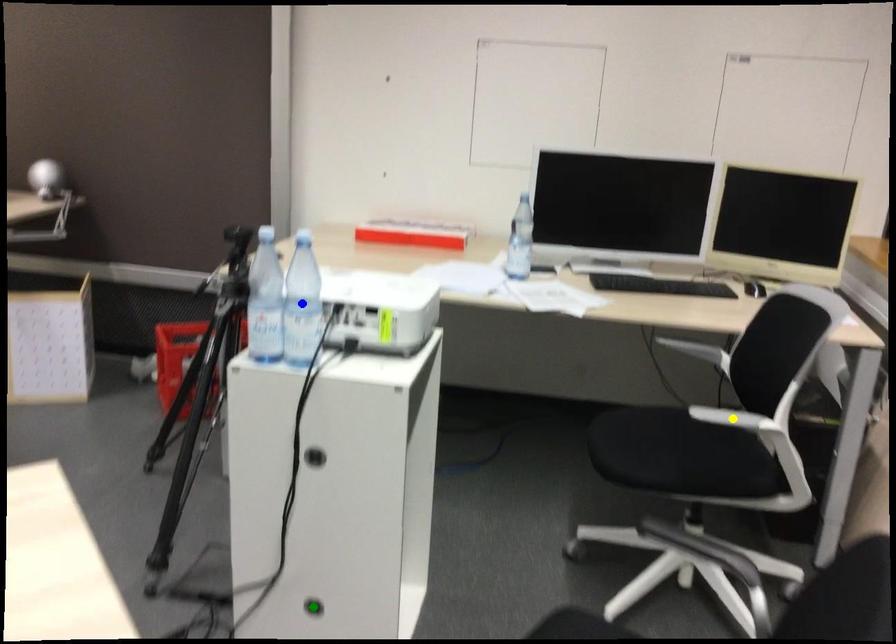
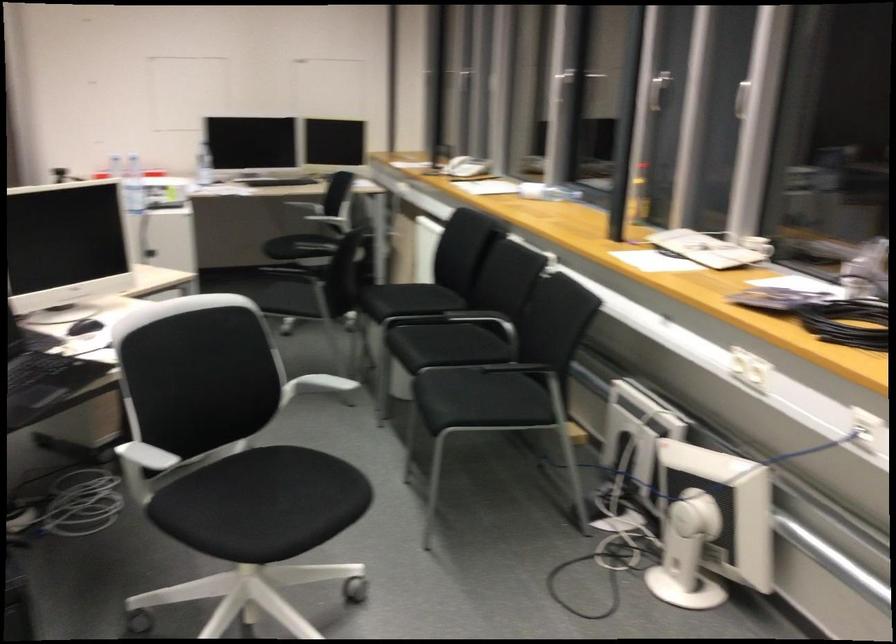
I am providing you with two images of the same scene from different viewpoints. Three points are marked in image1. Which point corresponds to a part or object that is occluded in image2?In image1, three points are marked. Which of them correspond to a part or object that is occluded in image2?Among the three points shown in image1, which one corresponds to a part or object that is no longer visible due to occlusion in image2?

yellow point, green point, blue point